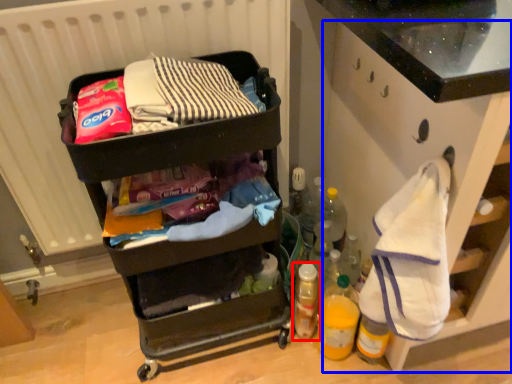
Question: Which object is further to the camera taking this photo, bottle (highlighted by a red box) or cabinetry (highlighted by a blue box)?

Choices:
 (A) bottle
 (B) cabinetry

Answer: (A)